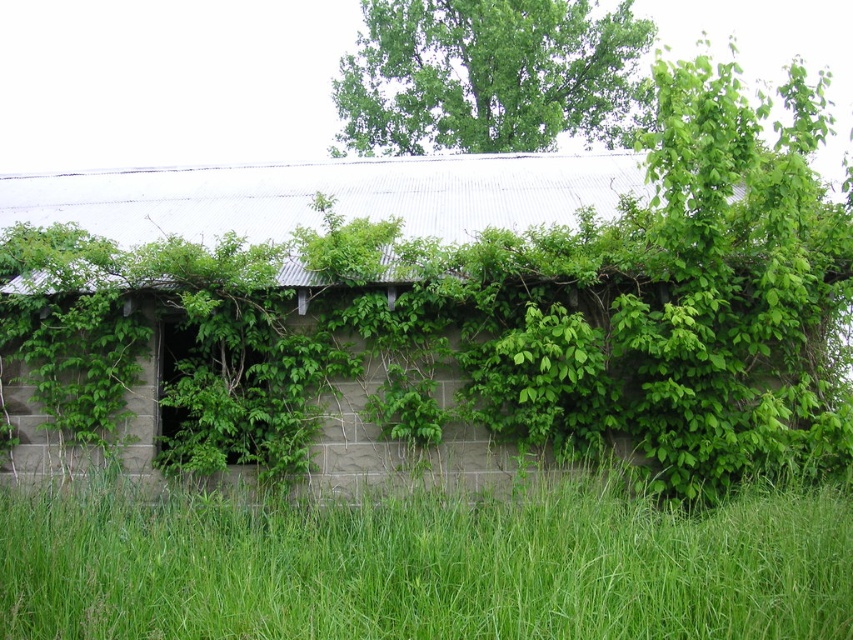
Question: Which of the following is the closest to the observer?

Choices:
 (A) green leafy tree at upper center
 (B) green grass at lower center

Answer: (B)

Question: Is green grass at lower center bigger than green leafy tree at upper center?

Choices:
 (A) no
 (B) yes

Answer: (A)

Question: Where is green grass at lower center located in relation to green leafy tree at upper center in the image?

Choices:
 (A) above
 (B) below

Answer: (B)

Question: Is green grass at lower center smaller than green leafy tree at upper center?

Choices:
 (A) yes
 (B) no

Answer: (A)

Question: Among these objects, which one is nearest to the camera?

Choices:
 (A) green grass at lower center
 (B) green leafy tree at upper center

Answer: (A)